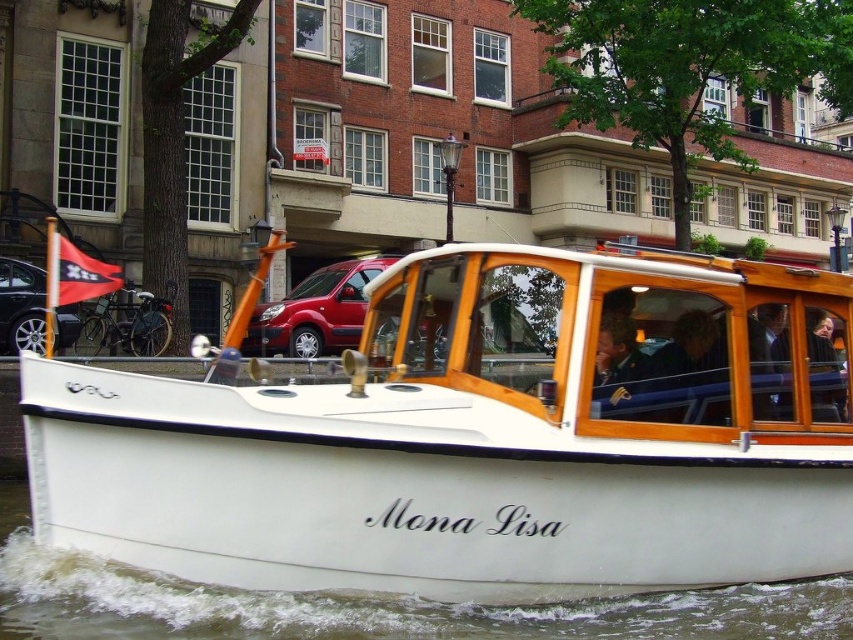
In the scene shown: Does white water at lower center have a lesser height compared to green military uniform at center?

Correct, white water at lower center is not as tall as green military uniform at center.

Is white water at lower center smaller than green military uniform at center?

Yes.

I want to click on white water at lower center, so click(x=364, y=605).

Which is above, white polished wood boat at center or white water at lower center?

white polished wood boat at center is above.

You are a GUI agent. You are given a task and a screenshot of the screen. Output one action in this format:
    pyautogui.click(x=<x>, y=<y>)
    Task: Click on the white polished wood boat at center
    The image size is (853, 640).
    Given the screenshot: What is the action you would take?
    pyautogui.click(x=483, y=440)

This screenshot has width=853, height=640. I want to click on white polished wood boat at center, so click(483, 440).

How distant is white polished wood boat at center from green military uniform at center?

A distance of 30.12 inches exists between white polished wood boat at center and green military uniform at center.

Who is shorter, white polished wood boat at center or green military uniform at center?

green military uniform at center is shorter.

This screenshot has width=853, height=640. What do you see at coordinates (483, 440) in the screenshot?
I see `white polished wood boat at center` at bounding box center [483, 440].

Locate an element on the screen. The image size is (853, 640). white polished wood boat at center is located at coordinates (483, 440).